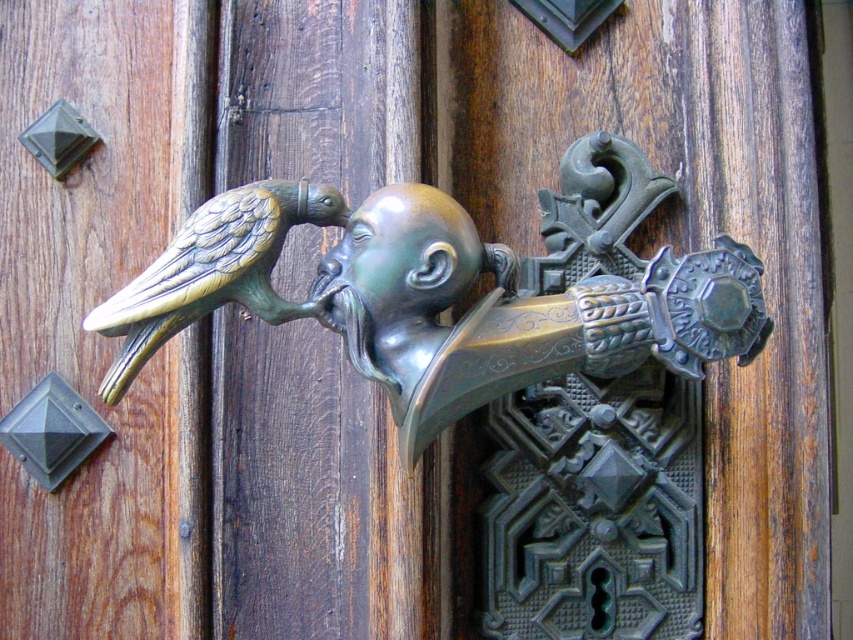
Who is shorter, bronze bird at center or gold-bronze bird at center-left?

With less height is gold-bronze bird at center-left.

Who is higher up, bronze bird at center or gold-bronze bird at center-left?

gold-bronze bird at center-left is higher up.

Is point (390, 284) closer to viewer compared to point (279, 180)?

Yes.

Image resolution: width=853 pixels, height=640 pixels. I want to click on bronze bird at center, so click(x=457, y=289).